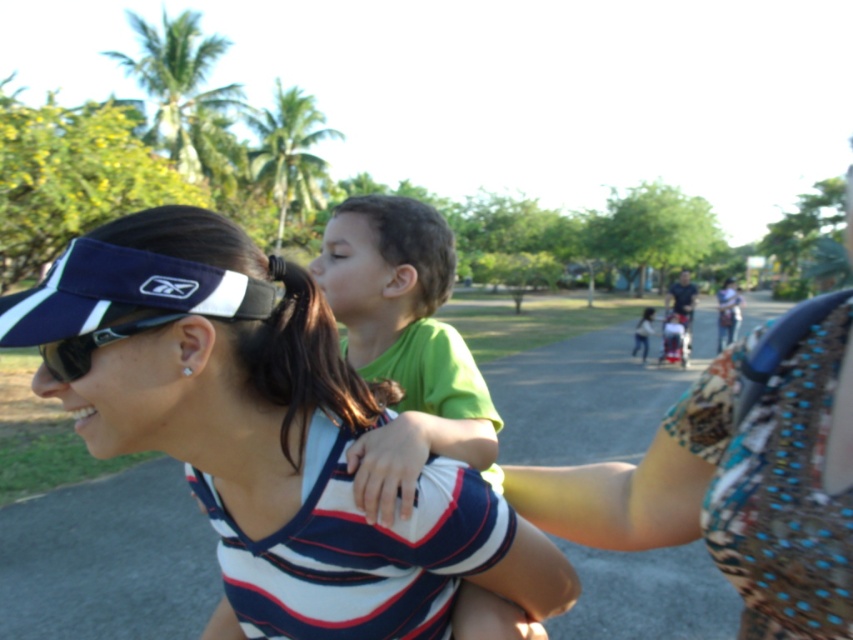
You are a photographer trying to capture a closeup of the polka dot fabric at center and the sunglasses at left. Since you can only focus on one object at a time, which one should you choose to ensure it appears sharp in the photo?

The polka dot fabric at center is in front of sunglasses at left, so focusing on the polka dot fabric at center will ensure it appears sharp while the sunglasses at left may be slightly out of focus. Alternatively, focusing on the sunglasses at left would leave the polka dot fabric at center sharp but the sunglasses might be blurry. To prioritize the closer object, choose the polka dot fabric at center.

You are standing at point (x=165, y=285) and want to walk to point (x=535, y=493). Which direction should you move first?

Point (x=535, y=493) is behind point (x=165, y=285), so you should move forward to reach it.